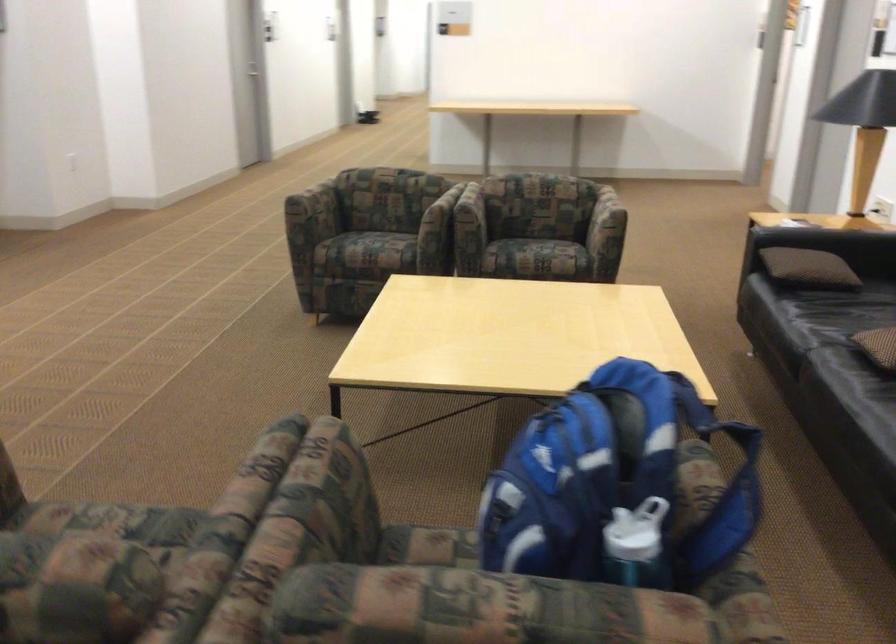
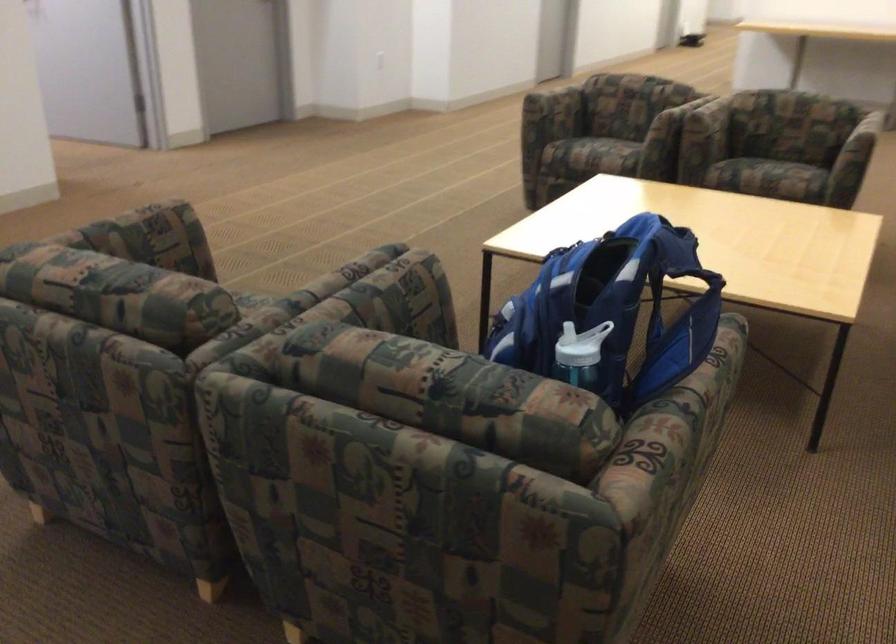
Locate, in the second image, the point that corresponds to the point at 302,498 in the first image.

(362, 292)